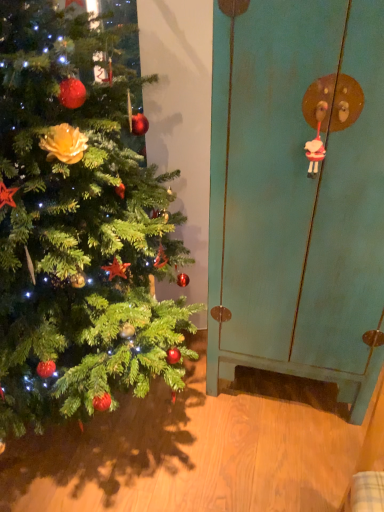
Question: Can you confirm if green matte christmas tree at left is thinner than teal matte cabinet at right?

Choices:
 (A) yes
 (B) no

Answer: (B)

Question: Is green matte christmas tree at left closer to the viewer compared to teal matte cabinet at right?

Choices:
 (A) yes
 (B) no

Answer: (A)

Question: From a real-world perspective, does green matte christmas tree at left sit lower than teal matte cabinet at right?

Choices:
 (A) yes
 (B) no

Answer: (B)

Question: Is green matte christmas tree at left wider than teal matte cabinet at right?

Choices:
 (A) no
 (B) yes

Answer: (B)

Question: Considering the relative positions of green matte christmas tree at left and teal matte cabinet at right in the image provided, is green matte christmas tree at left behind teal matte cabinet at right?

Choices:
 (A) yes
 (B) no

Answer: (B)

Question: From their relative heights in the image, would you say teal matte cabinet at right is taller or shorter than green matte christmas tree at left?

Choices:
 (A) tall
 (B) short

Answer: (A)

Question: From the image's perspective, relative to green matte christmas tree at left, is teal matte cabinet at right above or below?

Choices:
 (A) below
 (B) above

Answer: (B)

Question: Considering the positions of point click(311, 355) and point click(3, 245), is point click(311, 355) closer or farther from the camera than point click(3, 245)?

Choices:
 (A) closer
 (B) farther

Answer: (B)

Question: In the image, is teal matte cabinet at right positioned in front of or behind green matte christmas tree at left?

Choices:
 (A) front
 (B) behind

Answer: (B)

Question: Is white glossy sheep at upper right situated inside green matte christmas tree at left or outside?

Choices:
 (A) outside
 (B) inside

Answer: (A)

Question: In terms of height, does white glossy sheep at upper right look taller or shorter compared to green matte christmas tree at left?

Choices:
 (A) short
 (B) tall

Answer: (A)

Question: From a real-world perspective, is white glossy sheep at upper right physically located above or below green matte christmas tree at left?

Choices:
 (A) above
 (B) below

Answer: (A)

Question: Based on their positions, is white glossy sheep at upper right located to the left or right of green matte christmas tree at left?

Choices:
 (A) left
 (B) right

Answer: (B)

Question: Based on their sizes in the image, would you say green matte christmas tree at left is bigger or smaller than white glossy sheep at upper right?

Choices:
 (A) small
 (B) big

Answer: (B)

Question: In the image, is green matte christmas tree at left positioned in front of or behind white glossy sheep at upper right?

Choices:
 (A) front
 (B) behind

Answer: (A)